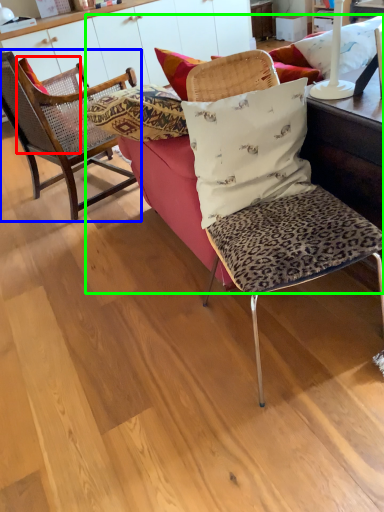
Question: Which object is the farthest from pillow (highlighted by a red box)? Choose among these: chair (highlighted by a blue box) or studio couch (highlighted by a green box).

Choices:
 (A) chair
 (B) studio couch

Answer: (B)